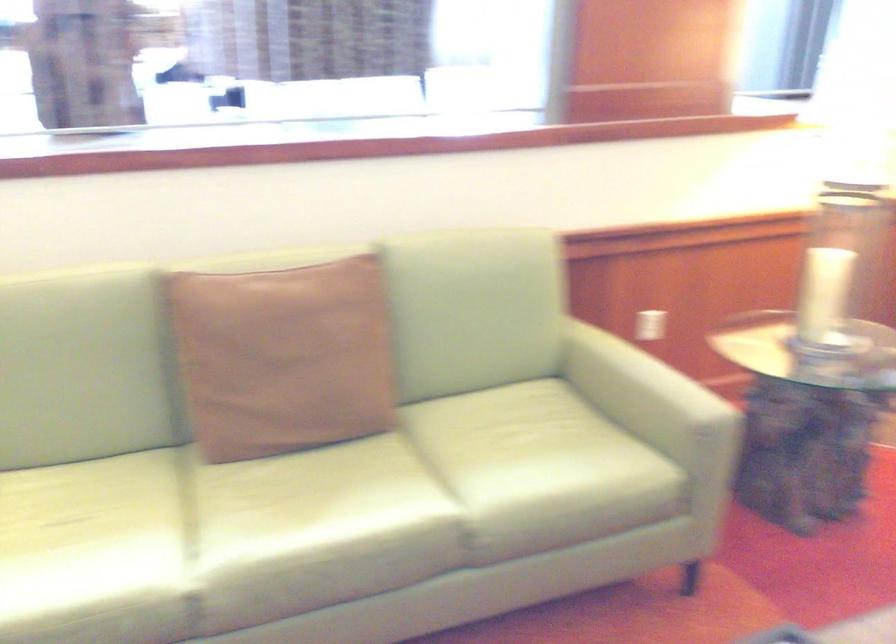
Find where to sit the sofa sitting surface. Please return your answer as a coordinate pair (x, y).

(299, 498)